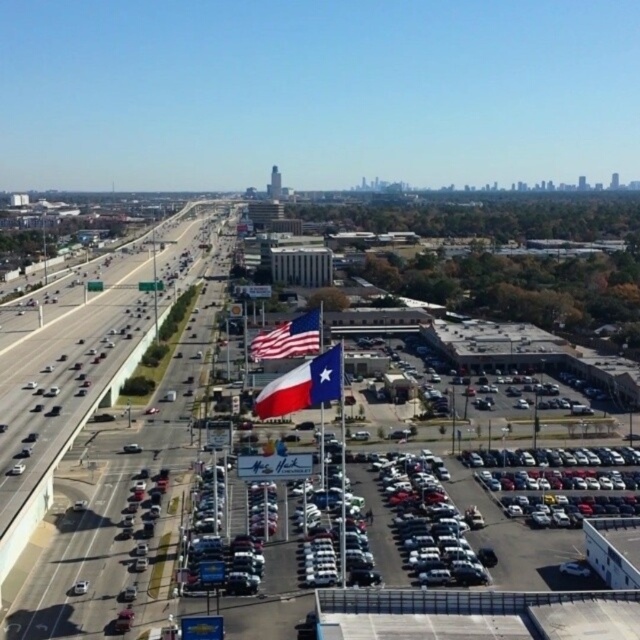
Is silver metallic car at lower right below texas flag at center?

Correct, silver metallic car at lower right is located below texas flag at center.

Where is `silver metallic car at lower right`? The image size is (640, 640). silver metallic car at lower right is located at coordinates (429, 524).

Describe the element at coordinates (106, 433) in the screenshot. The width and height of the screenshot is (640, 640). I see `asphalt road at center` at that location.

Is asphalt road at center above texas flag at center?

Yes.

Is point (164, 422) farther from camera compared to point (288, 392)?

Yes, point (164, 422) is farther from viewer.

The height and width of the screenshot is (640, 640). I want to click on asphalt road at center, so click(x=106, y=433).

Does metallic gray highway at left appear on the left side of texas flag at center?

Correct, you'll find metallic gray highway at left to the left of texas flag at center.

Who is more forward, (74,486) or (305,388)?

Point (305,388) is in front.

Where is `metallic gray highway at left`? The width and height of the screenshot is (640, 640). metallic gray highway at left is located at coordinates (83, 449).